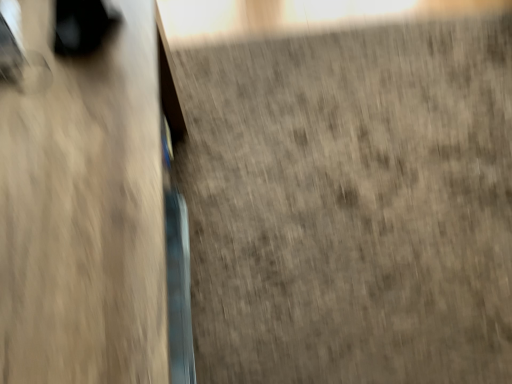
Question: Should I look upward or downward to see wooden table at left?

Choices:
 (A) up
 (B) down

Answer: (B)